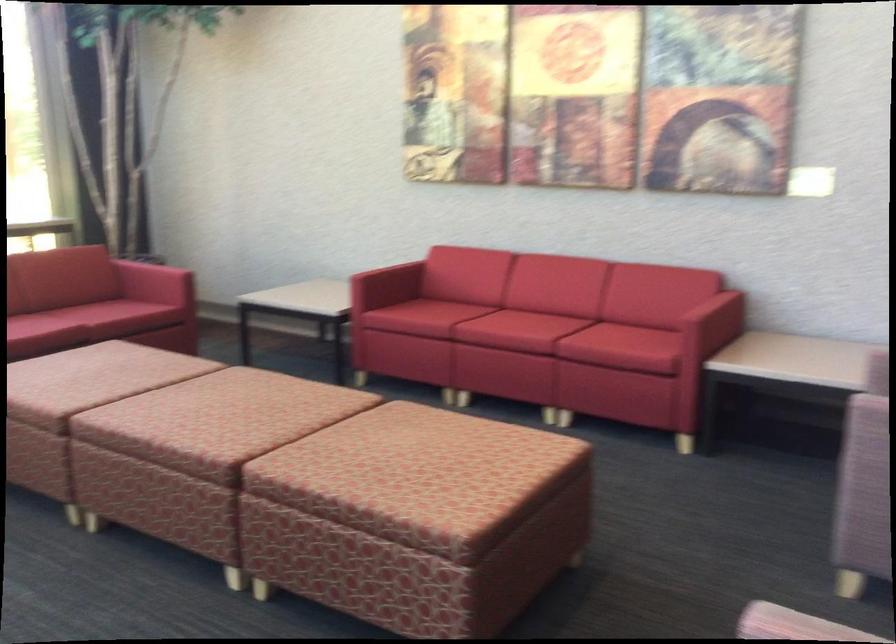
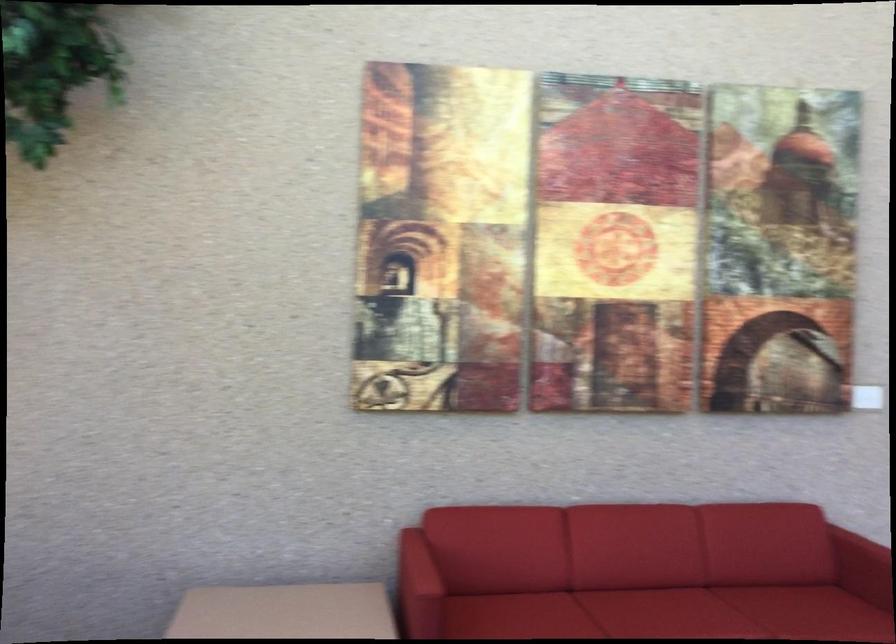
Find the pixel in the second image that matches pixel 526 313 in the first image.

(659, 607)